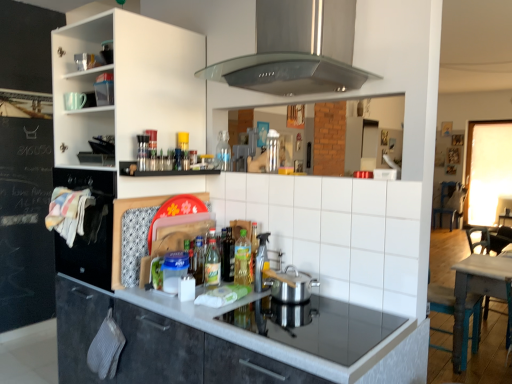
What are the coordinates of `vacant area situated to the left side of green plastic bottle at center, which is counted as the 2th bottle, starting from the front` in the screenshot? It's located at (223, 288).